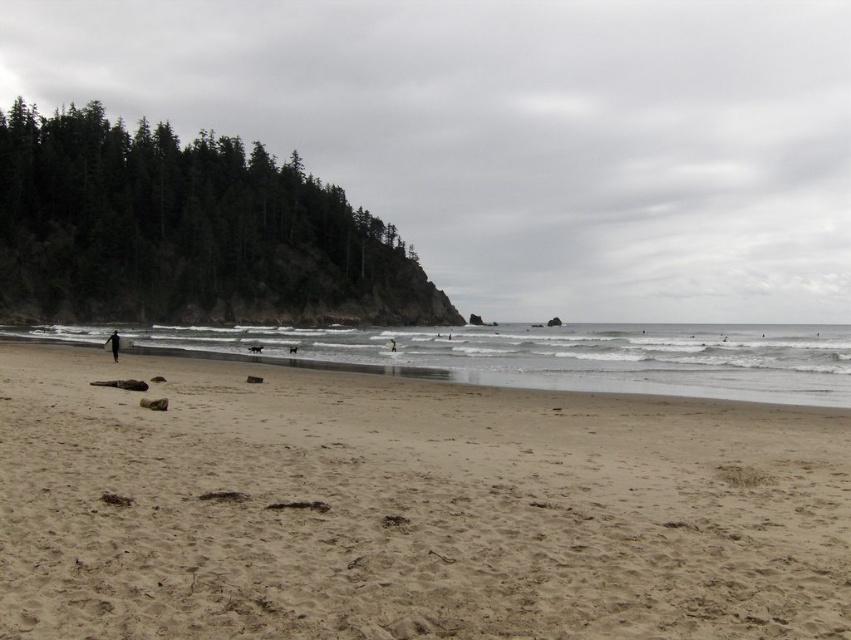
Who is more forward, (84,435) or (315,349)?

Point (84,435) is in front.

This screenshot has height=640, width=851. Identify the location of sandy beach at center. (407, 508).

Can you confirm if sandy beach at center is positioned to the left of brown sand at lower left?

Correct, you'll find sandy beach at center to the left of brown sand at lower left.

What do you see at coordinates (407, 508) in the screenshot?
I see `sandy beach at center` at bounding box center [407, 508].

Is point (324, 518) behind point (654, 33)?

That is False.

Identify the location of sandy beach at center. The width and height of the screenshot is (851, 640). (407, 508).

Between black matte surfboard at lower left and white cotton surfboard at center, which one has more height?

With more height is black matte surfboard at lower left.

Can you confirm if black matte surfboard at lower left is smaller than white cotton surfboard at center?

No.

Is point (118, 344) positioned behind point (387, 340)?

No.

Where is `black matte surfboard at lower left`? black matte surfboard at lower left is located at coordinates (113, 344).